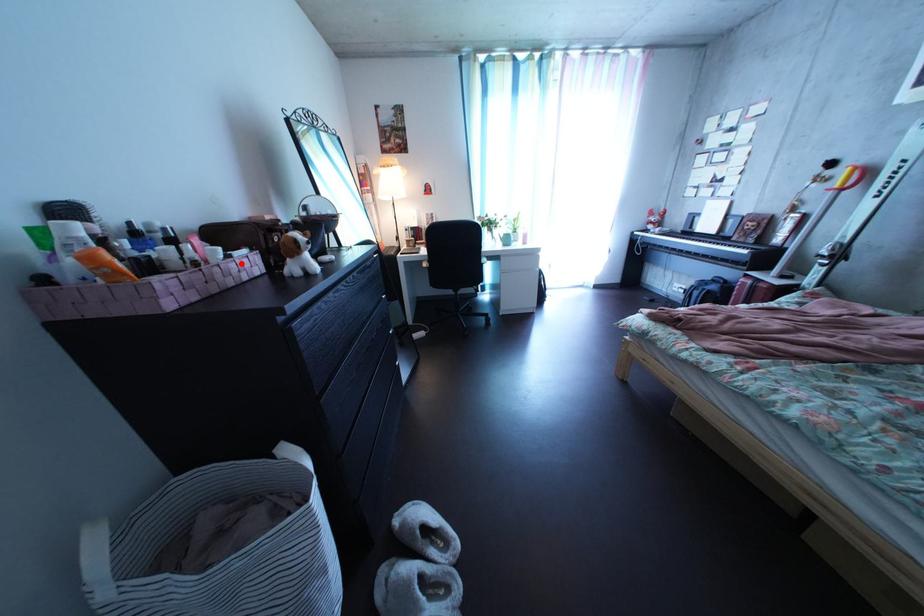
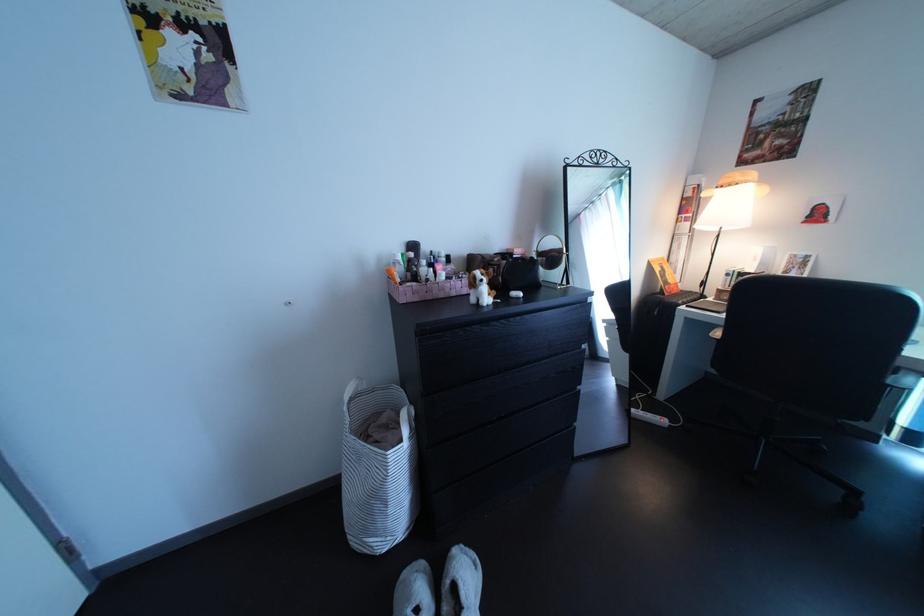
Find the pixel in the second image that matches the highlighted location in the first image.

(464, 286)